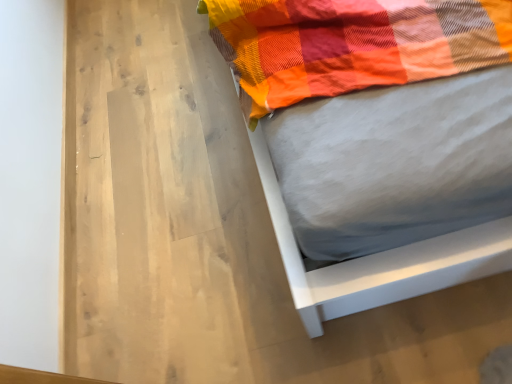
At what (x,y) coordinates should I click in order to perform the action: click on white matte bed at upper right. Please return your answer as a coordinate pair (x, y). This screenshot has height=384, width=512. Looking at the image, I should click on (353, 89).

Describe the element at coordinates (353, 89) in the screenshot. This screenshot has height=384, width=512. I see `white matte bed at upper right` at that location.

Locate an element on the screen. This screenshot has height=384, width=512. white matte bed at upper right is located at coordinates (353, 89).